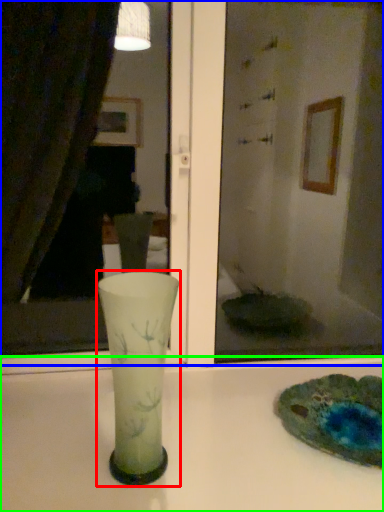
Question: Which object is the farthest from vase (highlighted by a red box)? Choose among these: mirror (highlighted by a blue box) or counter top (highlighted by a green box).

Choices:
 (A) mirror
 (B) counter top

Answer: (A)